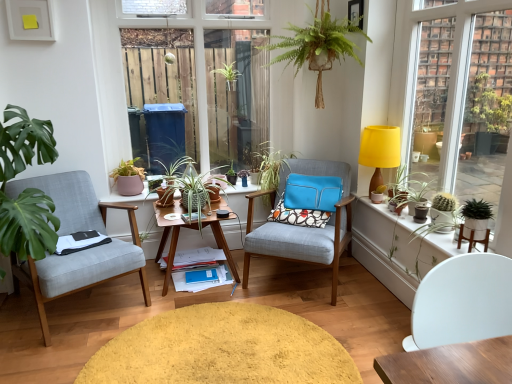
This screenshot has width=512, height=384. In order to click on free point below yellow plush rug at center (from a real-world perspective) in this screenshot , I will do `click(213, 340)`.